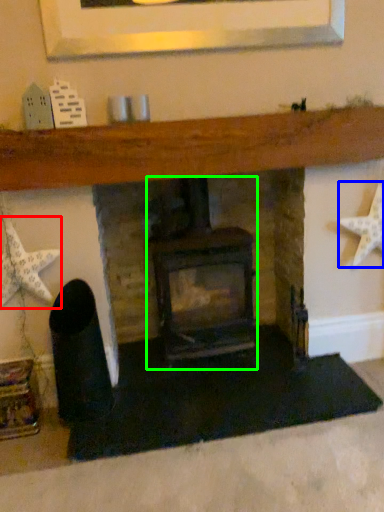
Question: Based on their relative distances, which object is nearer to starfish (highlighted by a red box)? Choose from starfish (highlighted by a blue box) and wood burning stove (highlighted by a green box).

Choices:
 (A) starfish
 (B) wood burning stove

Answer: (B)